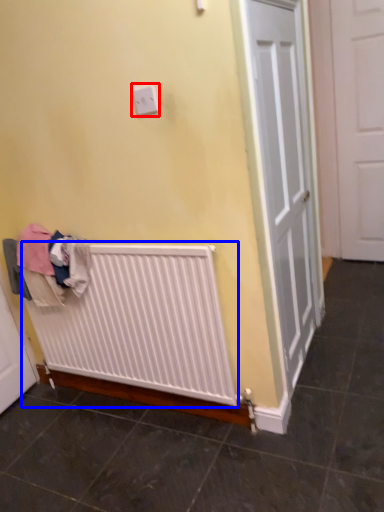
Question: Which object appears farthest to the camera in this image, electric outlet (highlighted by a red box) or radiator (highlighted by a blue box)?

Choices:
 (A) electric outlet
 (B) radiator

Answer: (B)